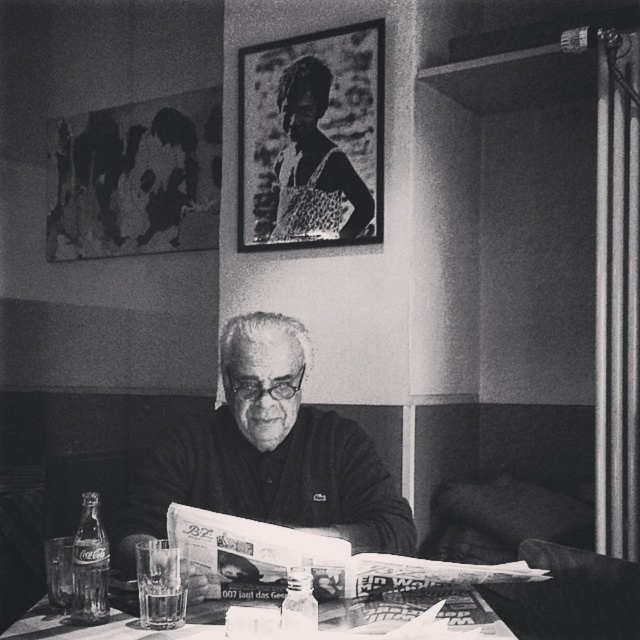
You are an interior designer assessing the layout of this room. You need to determine if the metallic frame at upper center can be placed on top of the smooth glass table at center without obstructing the view of the table. Based on their sizes, is this feasible?

The metallic frame at upper center has a greater height compared to the smooth glass table at center. Since the frame is taller than the table, placing it on top would likely block the view of the table below.

You are standing in the room and want to place a small book on the smooth glass table at center. However, the smooth black sweater at center might block your view. Is the sweater positioned in a way that would prevent you from seeing the table clearly?

The smooth black sweater at center is to the right of the smooth glass table at center, so placing a book on the table might still be possible, but the sweater could partially block the view depending on its exact placement.

What is the 2D coordinate of the metallic frame at upper center in the image?

The metallic frame at upper center is located at the 2D coordinate point of (x=310, y=140).